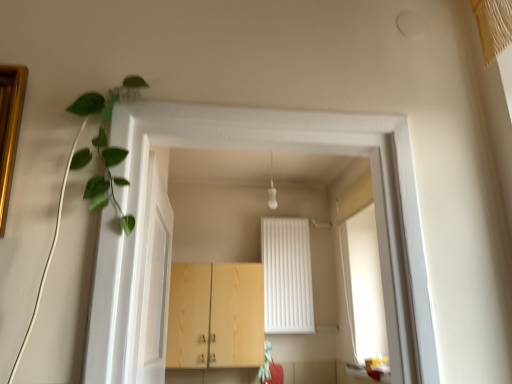
Question: Is green leafy plant at upper left not close to light wood cabinet at center?

Choices:
 (A) yes
 (B) no

Answer: (A)

Question: Is the surface of green leafy plant at upper left in direct contact with light wood cabinet at center?

Choices:
 (A) yes
 (B) no

Answer: (B)

Question: From the image's perspective, is green leafy plant at upper left above light wood cabinet at center?

Choices:
 (A) no
 (B) yes

Answer: (B)

Question: From a real-world perspective, is green leafy plant at upper left positioned over light wood cabinet at center based on gravity?

Choices:
 (A) no
 (B) yes

Answer: (B)

Question: Does green leafy plant at upper left have a larger size compared to light wood cabinet at center?

Choices:
 (A) no
 (B) yes

Answer: (A)

Question: In the image, is white glossy door at left positioned in front of or behind green leafy plant at upper left?

Choices:
 (A) behind
 (B) front

Answer: (A)

Question: Is white glossy door at left wider or thinner than green leafy plant at upper left?

Choices:
 (A) wide
 (B) thin

Answer: (A)

Question: Would you say white glossy door at left is inside or outside green leafy plant at upper left?

Choices:
 (A) inside
 (B) outside

Answer: (B)

Question: From the image's perspective, is white glossy door at left positioned above or below green leafy plant at upper left?

Choices:
 (A) below
 (B) above

Answer: (A)

Question: Looking at the image, does green leafy plant at upper left seem bigger or smaller compared to light wood cabinet at center?

Choices:
 (A) big
 (B) small

Answer: (B)

Question: Considering the positions of green leafy plant at upper left and light wood cabinet at center in the image, is green leafy plant at upper left wider or thinner than light wood cabinet at center?

Choices:
 (A) thin
 (B) wide

Answer: (A)

Question: Considering the relative positions of green leafy plant at upper left and light wood cabinet at center in the image provided, is green leafy plant at upper left to the left or to the right of light wood cabinet at center?

Choices:
 (A) left
 (B) right

Answer: (A)

Question: Would you say green leafy plant at upper left is inside or outside light wood cabinet at center?

Choices:
 (A) inside
 (B) outside

Answer: (B)

Question: Would you say white glossy door at left is to the left or to the right of light wood cabinet at center in the picture?

Choices:
 (A) right
 (B) left

Answer: (A)

Question: From the image's perspective, is white glossy door at left positioned above or below light wood cabinet at center?

Choices:
 (A) above
 (B) below

Answer: (A)